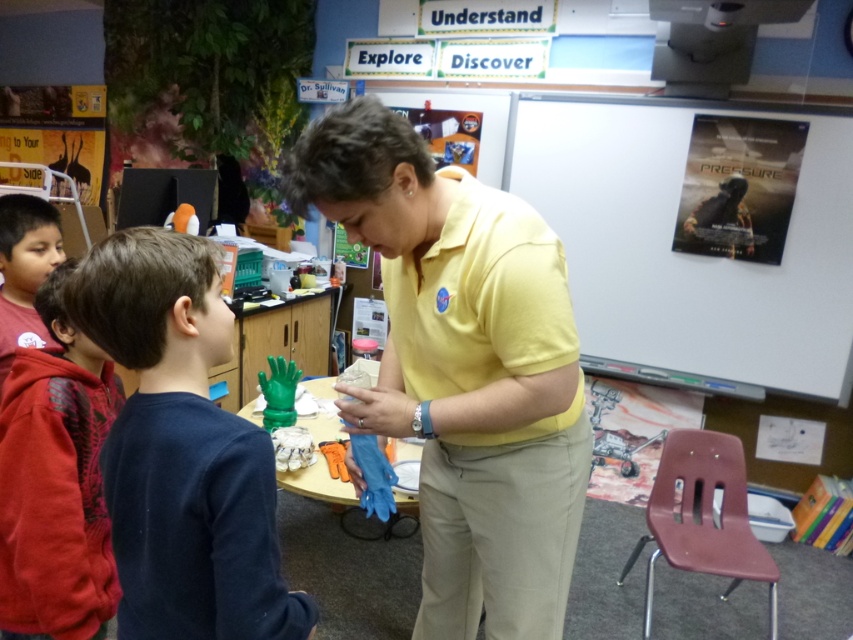
Question: Which of the following is the farthest from the observer?

Choices:
 (A) (228, 540)
 (B) (606, 177)

Answer: (B)

Question: Among these points, which one is farthest from the camera?

Choices:
 (A) (767, 116)
 (B) (144, 490)
 (C) (518, 435)
 (D) (33, 374)

Answer: (A)

Question: Can you confirm if dark blue sweater at center is positioned to the left of matte red hoodie at left?

Choices:
 (A) no
 (B) yes

Answer: (A)

Question: Does white matte poster at upper right appear under matte red hoodie at left?

Choices:
 (A) no
 (B) yes

Answer: (A)

Question: Can you confirm if dark blue sweater at center is positioned above red fleece hoodie at left?

Choices:
 (A) yes
 (B) no

Answer: (A)

Question: Which point is farther from the camera taking this photo?

Choices:
 (A) (126, 460)
 (B) (669, 268)
 (C) (316, 145)
 (D) (33, 584)

Answer: (B)